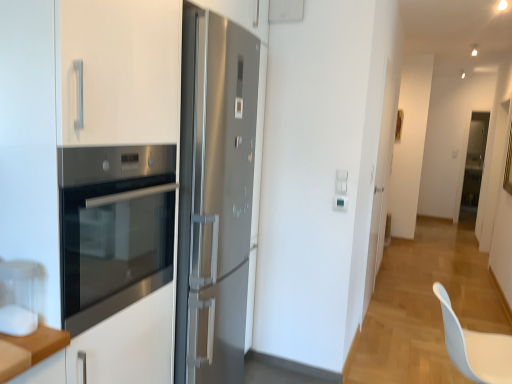
Image resolution: width=512 pixels, height=384 pixels. What do you see at coordinates (114, 228) in the screenshot?
I see `stainless steel oven at left` at bounding box center [114, 228].

This screenshot has height=384, width=512. What do you see at coordinates (76, 104) in the screenshot?
I see `white matte cabinet at left` at bounding box center [76, 104].

This screenshot has height=384, width=512. Find the location of `stainless steel oven at left`. stainless steel oven at left is located at coordinates (114, 228).

Between white plastic swivel chair at lower right and transparent glass door at center, which one appears on the left side from the viewer's perspective?

white plastic swivel chair at lower right.

From the image's perspective, would you say white plastic swivel chair at lower right is shown under transparent glass door at center?

Correct, white plastic swivel chair at lower right appears lower than transparent glass door at center in the image.

Is white plastic swivel chair at lower right oriented away from transparent glass door at center?

No, white plastic swivel chair at lower right's orientation is not away from transparent glass door at center.

Can you confirm if white plastic swivel chair at lower right is bigger than white matte cabinet at left?

No, white plastic swivel chair at lower right is not bigger than white matte cabinet at left.

Which object is closer to the camera, white plastic swivel chair at lower right or white matte cabinet at left?

Positioned in front is white matte cabinet at left.

From the picture: Does white plastic swivel chair at lower right have a greater width compared to white matte cabinet at left?

No, white plastic swivel chair at lower right is not wider than white matte cabinet at left.

Does white plastic swivel chair at lower right appear on the right side of white matte cabinet at left?

Yes.

Can you see stainless steel oven at left touching white matte cabinet at left?

No, stainless steel oven at left is not touching white matte cabinet at left.

In the scene shown: From a real-world perspective, who is located lower, stainless steel oven at left or white matte cabinet at left?

white matte cabinet at left.

From the image's perspective, is stainless steel oven at left on white matte cabinet at left?

Yes, from the image's perspective, stainless steel oven at left is on top of white matte cabinet at left.

How far apart are stainless steel oven at left and white plastic swivel chair at lower right?

stainless steel oven at left is 1.18 meters from white plastic swivel chair at lower right.

Which of these two, stainless steel oven at left or white plastic swivel chair at lower right, stands taller?

stainless steel oven at left is taller.

From a real-world perspective, which object stands above the other?

stainless steel oven at left is physically above.

Is transparent glass door at center smaller than white matte cabinet at left?

Correct, transparent glass door at center occupies less space than white matte cabinet at left.

Would you say white matte cabinet at left is part of transparent glass door at center's contents?

No, transparent glass door at center does not contain white matte cabinet at left.

What's the angular difference between transparent glass door at center and white matte cabinet at left's facing directions?

90.7 degrees separate the facing orientations of transparent glass door at center and white matte cabinet at left.

Does point (465, 203) come behind point (110, 372)?

Yes, it is behind point (110, 372).

Could you tell me if white matte cabinet at left is facing transparent glass door at center?

No, white matte cabinet at left is not aimed at transparent glass door at center.

From a real-world perspective, is white matte cabinet at left positioned above or below transparent glass door at center?

Clearly, from a real-world perspective, white matte cabinet at left is above transparent glass door at center.

Is point (129, 369) positioned before point (473, 210)?

Yes.

Is transparent glass door at center a part of white matte cabinet at left?

No, transparent glass door at center is not surrounded by white matte cabinet at left.

Considering the positions of objects stainless steel oven at left and transparent glass door at center in the image provided, who is in front, stainless steel oven at left or transparent glass door at center?

Positioned in front is stainless steel oven at left.

Is stainless steel oven at left facing towards transparent glass door at center?

No, stainless steel oven at left does not turn towards transparent glass door at center.

Does stainless steel oven at left have a greater width compared to transparent glass door at center?

Yes, stainless steel oven at left is wider than transparent glass door at center.

Measure the distance between stainless steel oven at left and transparent glass door at center.

They are 7.06 meters apart.

Where is `glass door located on the right of white plastic swivel chair at lower right`? The image size is (512, 384). glass door located on the right of white plastic swivel chair at lower right is located at coordinates (474, 166).

In the image, there is a white matte cabinet at left. In order to click on swivel chair below it (from the image's perspective) in this screenshot , I will do `click(475, 347)`.

Which object lies nearer to the anchor point stainless steel oven at left, white matte cabinet at left or transparent glass door at center?

white matte cabinet at left lies closer to stainless steel oven at left than the other object.

From the image, which object appears to be farther from white matte cabinet at left, stainless steel oven at left or white plastic swivel chair at lower right?

white plastic swivel chair at lower right is positioned further to the anchor white matte cabinet at left.

Looking at the image, which one is located closer to white plastic swivel chair at lower right, transparent glass door at center or stainless steel oven at left?

stainless steel oven at left.

Estimate the real-world distances between objects in this image. Which object is further from transparent glass door at center, white plastic swivel chair at lower right or stainless steel oven at left?

stainless steel oven at left is positioned further to the anchor transparent glass door at center.

Looking at the image, which one is located further to transparent glass door at center, white matte cabinet at left or stainless steel oven at left?

Among the two, stainless steel oven at left is located further to transparent glass door at center.

Considering their positions, is white matte cabinet at left positioned further to stainless steel oven at left than white plastic swivel chair at lower right?

white plastic swivel chair at lower right.

Looking at the image, which one is located further to stainless steel oven at left, transparent glass door at center or white matte cabinet at left?

transparent glass door at center is further to stainless steel oven at left.

Based on their spatial positions, is white matte cabinet at left or transparent glass door at center closer to white plastic swivel chair at lower right?

Based on the image, white matte cabinet at left appears to be nearer to white plastic swivel chair at lower right.

Locate an element on the screen. home appliance located between white matte cabinet at left and transparent glass door at center in the depth direction is located at coordinates (114, 228).

Identify the location of swivel chair between stainless steel oven at left and transparent glass door at center along the z-axis. (475, 347).

You are a GUI agent. You are given a task and a screenshot of the screen. Output one action in this format:
    pyautogui.click(x=<x>, y=<y>)
    Task: Click on the home appliance between white matte cabinet at left and white plastic swivel chair at lower right
    
    Given the screenshot: What is the action you would take?
    pyautogui.click(x=114, y=228)

I want to click on swivel chair between white matte cabinet at left and transparent glass door at center from front to back, so click(x=475, y=347).